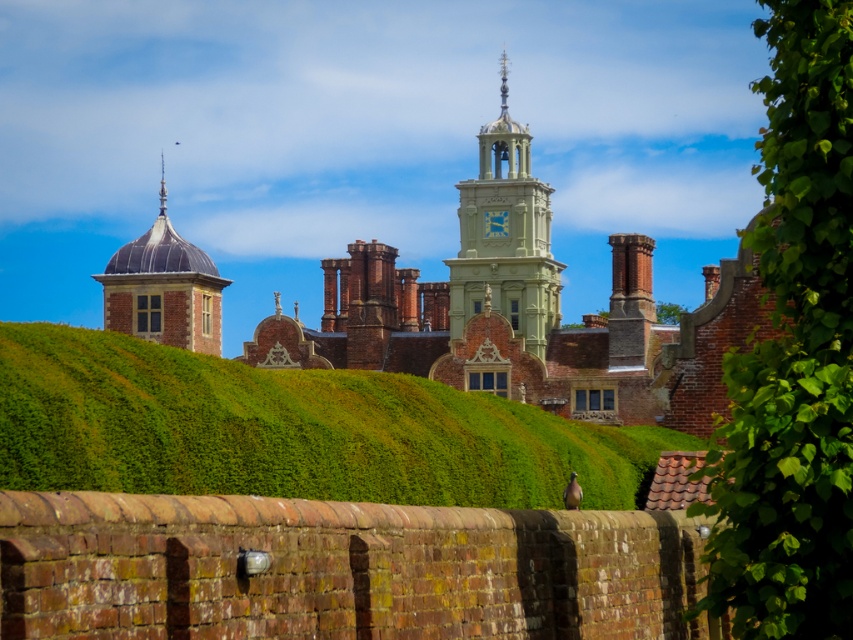
Measure the distance between green stone clock tower at center and smooth gray dome at upper left.

74.25 feet

Does point (525, 157) lie behind point (103, 323)?

That is False.

Locate an element on the screen. The image size is (853, 640). green stone clock tower at center is located at coordinates (505, 237).

Is green hedge at center below green stone clock tower at center?

Correct, green hedge at center is located below green stone clock tower at center.

Which is behind, point (212, 387) or point (454, 300)?

The point (454, 300) is behind.

The image size is (853, 640). Identify the location of green hedge at center. (289, 429).

Is green hedge at center bigger than green leafy hedge at right?

No.

Can you confirm if green hedge at center is thinner than green leafy hedge at right?

Yes.

Between point (350, 444) and point (828, 401), which one is positioned behind?

The point (350, 444) is behind.

Identify the location of green hedge at center. This screenshot has height=640, width=853. (289, 429).